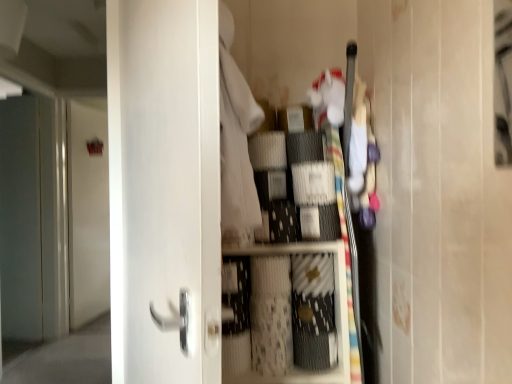
Question: Is matte gray screen door at left touching white glossy door at center, which appears as the first door when viewed from the right?

Choices:
 (A) yes
 (B) no

Answer: (B)

Question: Can you confirm if matte gray screen door at left is wider than white glossy door at center, which is counted as the 2th door, starting from the left?

Choices:
 (A) no
 (B) yes

Answer: (A)

Question: Is matte gray screen door at left smaller than white glossy door at center, which is counted as the second door, starting from the back?

Choices:
 (A) yes
 (B) no

Answer: (B)

Question: Could white glossy door at center, which is counted as the 2th door, starting from the left, be considered to be inside matte gray screen door at left?

Choices:
 (A) no
 (B) yes

Answer: (A)

Question: Is matte gray screen door at left behind white glossy door at center, which is counted as the second door, starting from the back?

Choices:
 (A) no
 (B) yes

Answer: (B)

Question: Does matte gray screen door at left appear on the right side of white glossy door at center, which is counted as the second door, starting from the back?

Choices:
 (A) no
 (B) yes

Answer: (A)

Question: Considering the relative sizes of white matte drawer at center and matte gray screen door at left in the image provided, is white matte drawer at center shorter than matte gray screen door at left?

Choices:
 (A) yes
 (B) no

Answer: (A)

Question: Does white matte drawer at center contain matte gray screen door at left?

Choices:
 (A) yes
 (B) no

Answer: (B)

Question: From the image's perspective, is white matte drawer at center on matte gray screen door at left?

Choices:
 (A) no
 (B) yes

Answer: (A)

Question: Is white matte drawer at center outside of matte gray screen door at left?

Choices:
 (A) no
 (B) yes

Answer: (B)

Question: From the image's perspective, would you say white matte drawer at center is shown under matte gray screen door at left?

Choices:
 (A) no
 (B) yes

Answer: (B)

Question: Can you confirm if white matte drawer at center is smaller than matte gray screen door at left?

Choices:
 (A) yes
 (B) no

Answer: (A)

Question: Does white matte door at upper left, placed as the first door when sorted from left to right, have a greater height compared to white glossy door at center, which is counted as the 2th door, starting from the left?

Choices:
 (A) no
 (B) yes

Answer: (B)